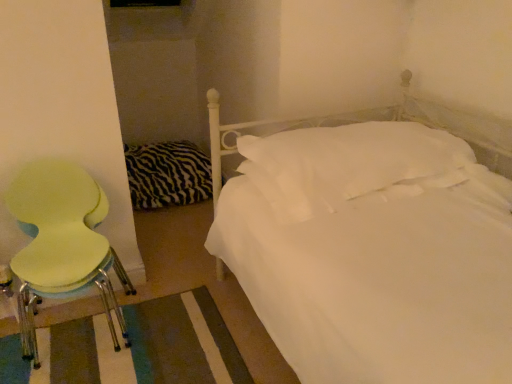
The image size is (512, 384). What do you see at coordinates (62, 244) in the screenshot?
I see `light green plastic chair at left` at bounding box center [62, 244].

Identify the location of zebra-patterned fabric at left. Image resolution: width=512 pixels, height=384 pixels. (168, 174).

Considering the positions of points (145, 188) and (273, 156), is point (145, 188) farther from camera compared to point (273, 156)?

Yes, it is.

Is zebra-patterned fabric at left positioned beyond the bounds of white soft pillow at center?

zebra-patterned fabric at left lies outside white soft pillow at center's area.

From a real-world perspective, is zebra-patterned fabric at left on top of white soft pillow at center?

No, from a real-world perspective, zebra-patterned fabric at left is not above white soft pillow at center.

Considering the relative sizes of light green plastic chair at left and zebra-patterned fabric at left in the image provided, is light green plastic chair at left bigger than zebra-patterned fabric at left?

Indeed, light green plastic chair at left has a larger size compared to zebra-patterned fabric at left.

Image resolution: width=512 pixels, height=384 pixels. I want to click on chair in front of the zebra-patterned fabric at left, so click(62, 244).

From the image's perspective, between light green plastic chair at left and zebra-patterned fabric at left, which one is located above?

zebra-patterned fabric at left appears higher in the image.

How much distance is there between light green plastic chair at left and zebra-patterned fabric at left?

3.47 feet.

From the image's perspective, is zebra-patterned fabric at left located above or below light green plastic chair at left?

zebra-patterned fabric at left is above light green plastic chair at left.

Considering the relative sizes of zebra-patterned fabric at left and light green plastic chair at left in the image provided, is zebra-patterned fabric at left wider than light green plastic chair at left?

Indeed, zebra-patterned fabric at left has a greater width compared to light green plastic chair at left.

Is point (152, 189) positioned in front of point (77, 268)?

That is False.

Is zebra-patterned fabric at left inside or outside of light green plastic chair at left?

zebra-patterned fabric at left exists outside the volume of light green plastic chair at left.

From a real-world perspective, is light green plastic chair at left on white soft pillow at center?

Incorrect, from a real-world perspective, light green plastic chair at left is lower than white soft pillow at center.

Which object is more forward, light green plastic chair at left or white soft pillow at center?

light green plastic chair at left is in front.

Does light green plastic chair at left appear on the left side of white soft pillow at center?

Indeed, light green plastic chair at left is positioned on the left side of white soft pillow at center.

Based on the photo, is white soft pillow at center looking in the opposite direction of light green plastic chair at left?

That's not correct — white soft pillow at center is not looking away from light green plastic chair at left.

Looking at this image, who is smaller, white soft pillow at center or light green plastic chair at left?

white soft pillow at center.

Is point (314, 195) positioned in front of point (65, 195)?

Yes.

Locate an element on the screen. pillow on the right of light green plastic chair at left is located at coordinates (x=350, y=164).

Considering the relative sizes of white soft pillow at center and zebra-patterned fabric at left in the image provided, is white soft pillow at center thinner than zebra-patterned fabric at left?

In fact, white soft pillow at center might be wider than zebra-patterned fabric at left.

Which of these two, white soft pillow at center or zebra-patterned fabric at left, is bigger?

zebra-patterned fabric at left is bigger.

Is white soft pillow at center positioned in front of zebra-patterned fabric at left?

That is True.

I want to click on pillow in front of the zebra-patterned fabric at left, so click(x=350, y=164).

This screenshot has height=384, width=512. I want to click on bedding that appears on the right of light green plastic chair at left, so tap(168, 174).

Considering their positions, is white soft pillow at center positioned closer to light green plastic chair at left than zebra-patterned fabric at left?

white soft pillow at center is closer to light green plastic chair at left.

Which object lies nearer to the anchor point light green plastic chair at left, zebra-patterned fabric at left or white soft pillow at center?

white soft pillow at center is closer to light green plastic chair at left.

Looking at the image, which one is located closer to zebra-patterned fabric at left, white soft pillow at center or light green plastic chair at left?

Among the two, light green plastic chair at left is located nearer to zebra-patterned fabric at left.

Based on their spatial positions, is light green plastic chair at left or white soft pillow at center closer to zebra-patterned fabric at left?

The object closer to zebra-patterned fabric at left is light green plastic chair at left.

Considering their positions, is zebra-patterned fabric at left positioned further to white soft pillow at center than light green plastic chair at left?

Among the two, zebra-patterned fabric at left is located further to white soft pillow at center.

Considering their positions, is light green plastic chair at left positioned further to white soft pillow at center than zebra-patterned fabric at left?

zebra-patterned fabric at left.

Where is `pillow between light green plastic chair at left and zebra-patterned fabric at left in the front-back direction`? The width and height of the screenshot is (512, 384). pillow between light green plastic chair at left and zebra-patterned fabric at left in the front-back direction is located at coordinates (350, 164).